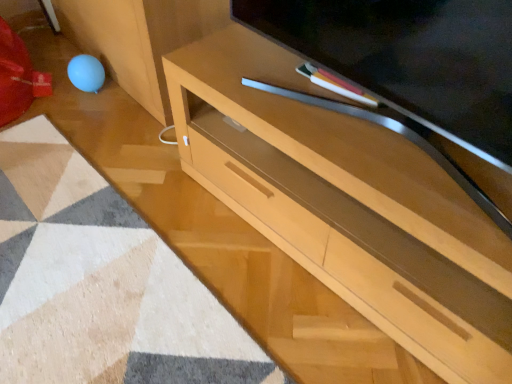
Locate an element on the screen. This screenshot has height=384, width=512. vacant space underneath matte wood television at center (from a real-world perspective) is located at coordinates (353, 121).